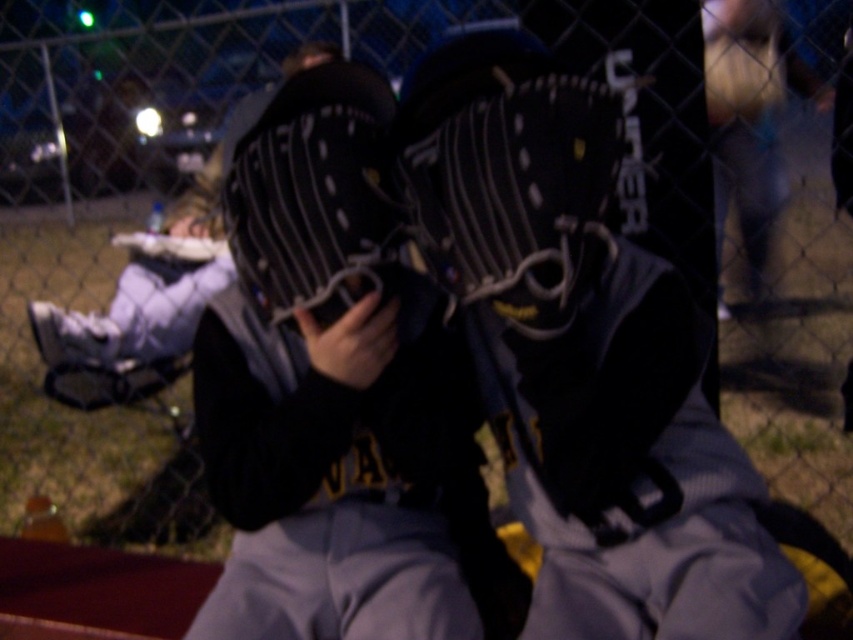
You are a photographer trying to capture a clear shot of both the black matte baseball uniform at center and the black leather baseball glove at left. Based on their sizes, which object should you focus on first to ensure it fits entirely within your camera frame?

The black leather baseball glove at left is taller than the black matte baseball uniform at center, so you should focus on capturing the black leather baseball glove at left first to ensure it fits within the frame.